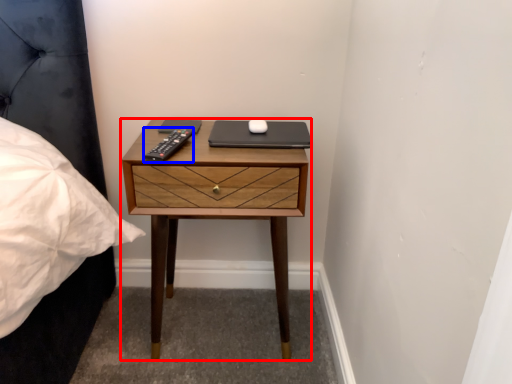
Question: Which of the following is the closest to the observer, nightstand (highlighted by a red box) or remote (highlighted by a blue box)?

Choices:
 (A) nightstand
 (B) remote

Answer: (B)